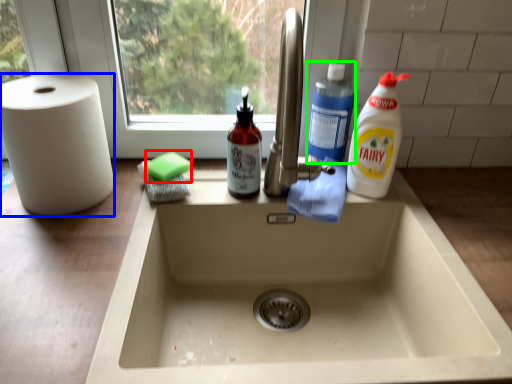
Question: Based on their relative distances, which object is nearer to soap (highlighted by a red box)? Choose from paper towel (highlighted by a blue box) and cleaning product (highlighted by a green box).

Choices:
 (A) paper towel
 (B) cleaning product

Answer: (A)